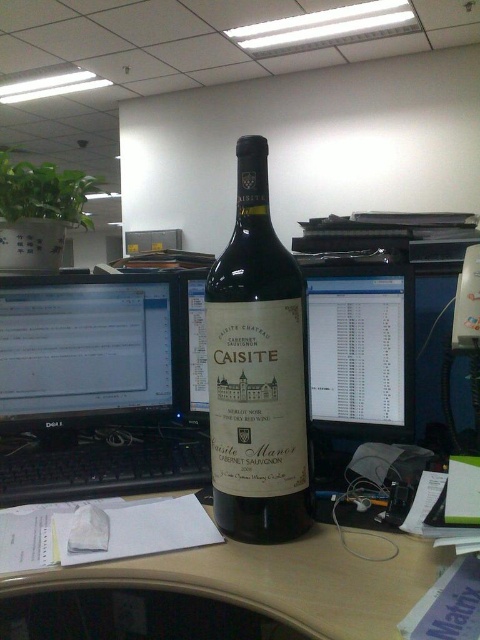
Question: Can you confirm if matte glass wine bottle at center is thinner than matte black monitor at center?

Choices:
 (A) no
 (B) yes

Answer: (B)

Question: Which point appears farthest from the camera in this image?

Choices:
 (A) (139, 330)
 (B) (297, 266)

Answer: (A)

Question: Which of these objects is positioned closest to the matte glass wine bottle at center?

Choices:
 (A) black glossy monitor at left
 (B) matte black monitor at center

Answer: (B)

Question: Is matte glass wine bottle at center bigger than matte black monitor at center?

Choices:
 (A) yes
 (B) no

Answer: (A)

Question: Can you confirm if black glossy monitor at left is positioned to the left of matte black monitor at center?

Choices:
 (A) yes
 (B) no

Answer: (A)

Question: Which point is farther from the camera taking this photo?

Choices:
 (A) (331, 396)
 (B) (36, 412)

Answer: (B)